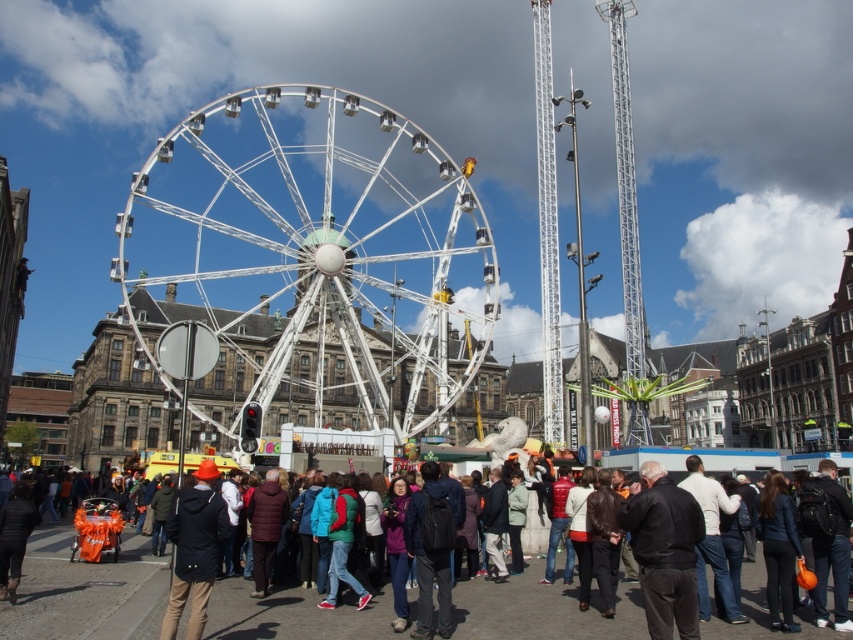
You are a photographer planning to take a photo of the white metallic ferris wheel at center and the matte black jacket at lower left. You want to ensure both are in frame. Given their sizes, which object should you zoom in on more to include both in the photo?

The white metallic ferris wheel at center is larger in width than the matte black jacket at lower left. To include both in the photo, you should zoom out slightly to accommodate the larger size of the ferris wheel while still capturing the smaller jacket.

You are standing at the base of the Ferris wheel and want to hand an item to someone holding the black leather jacket at center without moving from your spot. The orange fabric bag at center is in your possession. Given that the minimum throwing distance required to reach the jacket holder is 15 meters, is it possible to successfully make the throw?

The orange fabric bag at center is 14.61 meters from the black leather jacket at center. Since the required minimum distance is 15 meters, the throw would fall short, making it impossible to successfully reach the target.

You are a photographer standing in the crowd at the base of the Ferris wheel. You notice an orange fabric bag at center and a black leather jacket at center. Which item is closer to the ground?

The orange fabric bag at center is positioned under the black leather jacket at center, so it is closer to the ground.